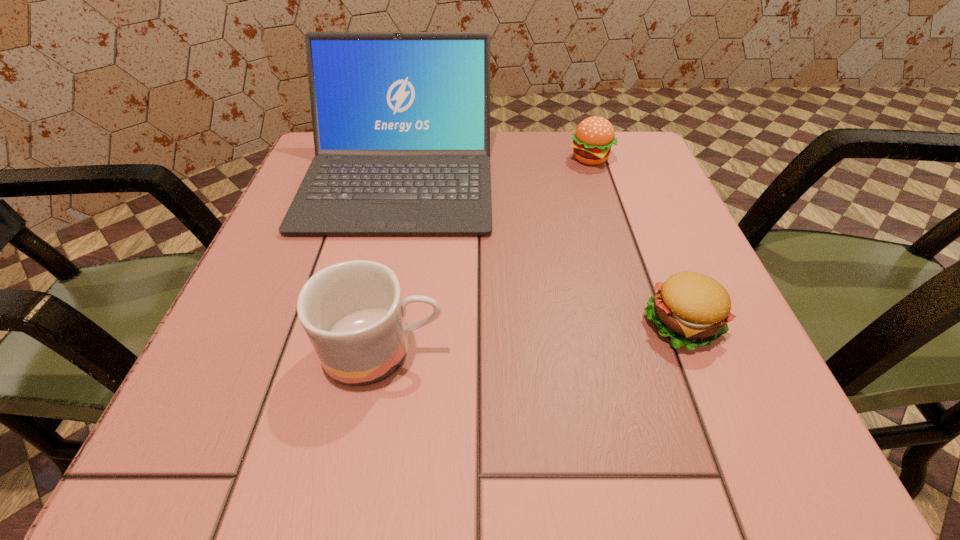
Where is `hamburger at the far edge`? hamburger at the far edge is located at coordinates (594, 136).

Locate an element on the screen. The image size is (960, 540). laptop computer situated at the left edge is located at coordinates (401, 120).

I want to click on mug positioned at the left edge, so click(x=352, y=312).

Image resolution: width=960 pixels, height=540 pixels. In order to click on object situated at the far left corner in this screenshot , I will do `click(401, 120)`.

In order to click on object located in the far right corner section of the desktop in this screenshot , I will do `click(594, 136)`.

This screenshot has width=960, height=540. In order to click on vacant space at the far edge of the desktop in this screenshot , I will do `click(559, 151)`.

Find the location of `free region at the near edge`. free region at the near edge is located at coordinates (643, 446).

Where is `free space at the left edge of the desktop`? free space at the left edge of the desktop is located at coordinates (327, 260).

Identify the location of vacant region at the right edge of the desktop. The image size is (960, 540). (668, 233).

The image size is (960, 540). In order to click on vacant position at the near right corner of the desktop in this screenshot , I will do `click(789, 470)`.